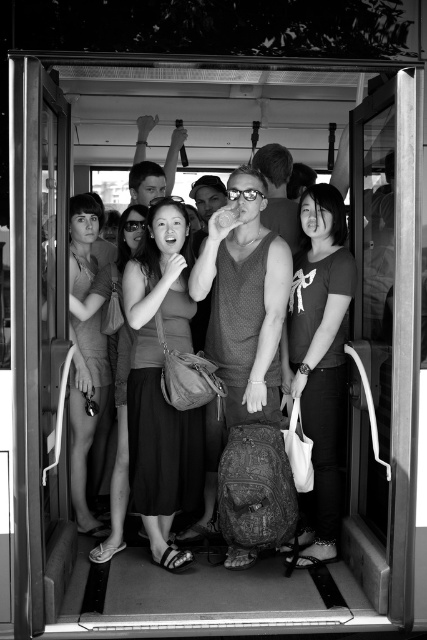
Question: Where is black matte t-shirt at center located in relation to matte fabric dress at left in the image?

Choices:
 (A) left
 (B) right

Answer: (B)

Question: Which of these objects is positioned closest to the matte gray dress at center?

Choices:
 (A) black matte t-shirt at center
 (B) matte fabric dress at left

Answer: (B)

Question: Does matte gray dress at center have a smaller size compared to matte fabric dress at left?

Choices:
 (A) no
 (B) yes

Answer: (B)

Question: Which of these objects is positioned closest to the matte fabric dress at left?

Choices:
 (A) matte gray dress at center
 (B) black matte t-shirt at center

Answer: (A)

Question: Which of these objects is positioned closest to the matte fabric dress at left?

Choices:
 (A) matte gray dress at center
 (B) black matte t-shirt at center

Answer: (A)

Question: From the image, what is the correct spatial relationship of black matte t-shirt at center in relation to matte fabric dress at left?

Choices:
 (A) below
 (B) above

Answer: (A)